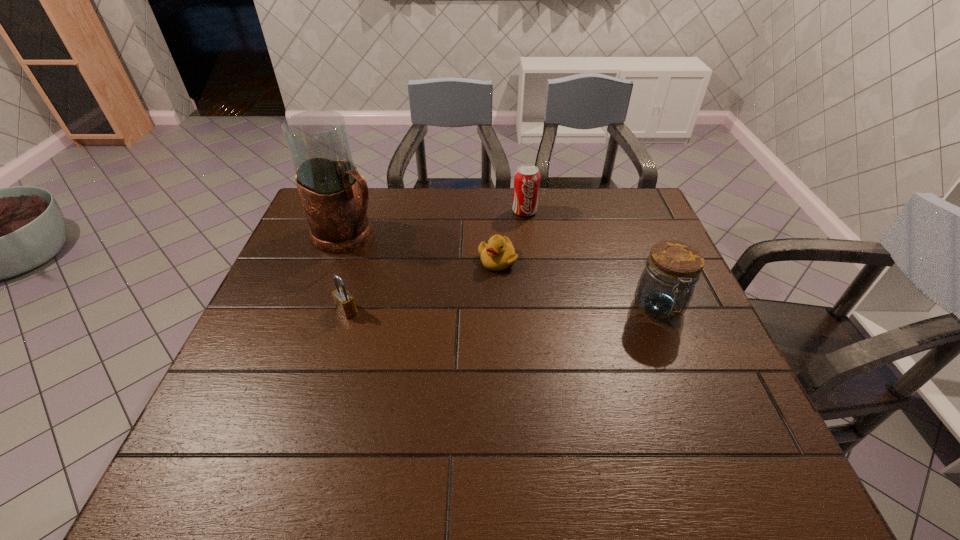
At what (x,y) coordinates should I click in order to perform the action: click on padlock. Please return your answer as a coordinate pair (x, y). Looking at the image, I should click on (344, 301).

Image resolution: width=960 pixels, height=540 pixels. I want to click on the rightmost object, so click(665, 288).

Image resolution: width=960 pixels, height=540 pixels. In order to click on the third tallest object in this screenshot , I will do `click(527, 177)`.

This screenshot has height=540, width=960. What are the coordinates of `soda can` in the screenshot? It's located at (527, 177).

Where is `pitcher`? The height and width of the screenshot is (540, 960). pitcher is located at coordinates (335, 197).

I want to click on duckling, so click(498, 254).

This screenshot has height=540, width=960. What are the coordinates of `the shortest object` in the screenshot? It's located at (498, 254).

The height and width of the screenshot is (540, 960). Find the location of `free space located on the front of the fourth tallest object`. free space located on the front of the fourth tallest object is located at coordinates (340, 335).

Find the location of `vacant space located 0.160m on the lid of the rightmost object`. vacant space located 0.160m on the lid of the rightmost object is located at coordinates (690, 386).

The width and height of the screenshot is (960, 540). In order to click on free region located on the logo side of the fourth object from left to right in this screenshot , I will do `click(528, 228)`.